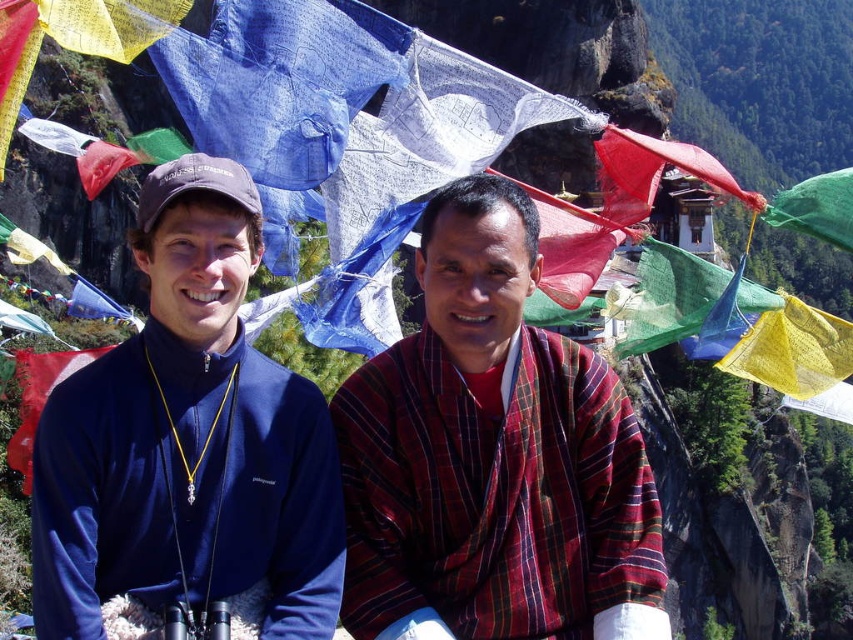
Question: Is plaid fabric shirt at center smaller than navy blue fleece at left?

Choices:
 (A) no
 (B) yes

Answer: (B)

Question: Can you confirm if plaid fabric shirt at center is positioned to the left of navy blue fleece at left?

Choices:
 (A) yes
 (B) no

Answer: (B)

Question: Which point is closer to the camera?

Choices:
 (A) (590, 416)
 (B) (67, 381)

Answer: (B)

Question: Among these points, which one is nearest to the camera?

Choices:
 (A) (518, 205)
 (B) (218, 476)

Answer: (B)

Question: Does plaid fabric shirt at center appear over navy blue fleece at left?

Choices:
 (A) no
 (B) yes

Answer: (A)